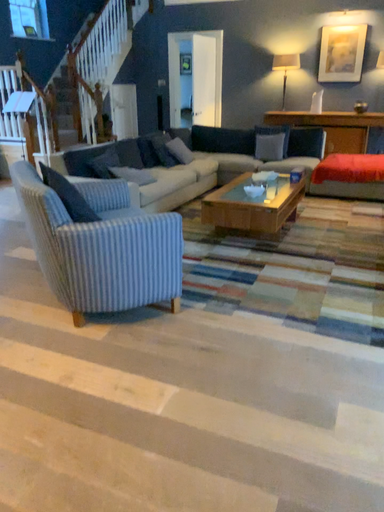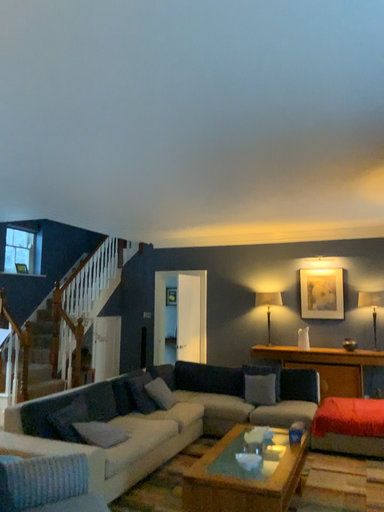
Question: How did the camera likely rotate when shooting the video?

Choices:
 (A) rotated downward
 (B) rotated upward

Answer: (B)